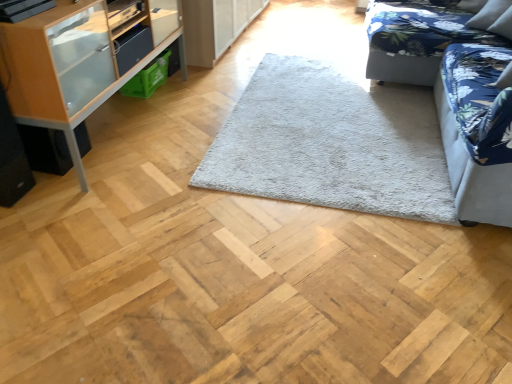
You are a GUI agent. You are given a task and a screenshot of the screen. Output one action in this format:
    pyautogui.click(x=<x>, y=<y>)
    Task: Click on the velvet floral studio couch at right, acting as the second studio couch starting from the back
    The height and width of the screenshot is (384, 512).
    Given the screenshot: What is the action you would take?
    pyautogui.click(x=476, y=131)

This screenshot has height=384, width=512. In order to click on blue floral fabric couch at upper right, the first studio couch in the back-to-front sequence in this screenshot , I will do `click(425, 37)`.

The height and width of the screenshot is (384, 512). I want to click on wooden cabinet at left, so click(x=70, y=65).

Does point (477, 45) appear closer or farther from the camera than point (115, 55)?

Clearly, point (477, 45) is more distant from the camera than point (115, 55).

How distant is velvet floral studio couch at right, acting as the second studio couch starting from the back, from matte black drawer at upper left?

velvet floral studio couch at right, acting as the second studio couch starting from the back, and matte black drawer at upper left are 6.01 feet apart.

Looking at this image, is velvet floral studio couch at right, the first studio couch viewed from the front, further to camera compared to matte black drawer at upper left?

No.

From the picture: How different are the orientations of velvet floral studio couch at right, acting as the second studio couch starting from the back, and matte black drawer at upper left in degrees?

180 degrees.

From the image's perspective, is blue floral fabric couch at upper right, the first studio couch in the back-to-front sequence, on velvet floral studio couch at right, the first studio couch viewed from the front?

Yes, from the image's perspective, blue floral fabric couch at upper right, the first studio couch in the back-to-front sequence, is above velvet floral studio couch at right, the first studio couch viewed from the front.

Which object is positioned more to the left, blue floral fabric couch at upper right, the 2th studio couch positioned from the front, or velvet floral studio couch at right, acting as the second studio couch starting from the back?

velvet floral studio couch at right, acting as the second studio couch starting from the back, is more to the left.

Considering the sizes of objects blue floral fabric couch at upper right, the first studio couch in the back-to-front sequence, and velvet floral studio couch at right, acting as the second studio couch starting from the back, in the image provided, who is bigger, blue floral fabric couch at upper right, the first studio couch in the back-to-front sequence, or velvet floral studio couch at right, acting as the second studio couch starting from the back,?

blue floral fabric couch at upper right, the first studio couch in the back-to-front sequence, is bigger.

Does velvet floral studio couch at right, acting as the second studio couch starting from the back, contain wooden cabinet at left?

No, wooden cabinet at left is not inside velvet floral studio couch at right, acting as the second studio couch starting from the back.

Is velvet floral studio couch at right, the first studio couch viewed from the front, aimed at wooden cabinet at left?

Yes, velvet floral studio couch at right, the first studio couch viewed from the front, faces towards wooden cabinet at left.

From a real-world perspective, is velvet floral studio couch at right, acting as the second studio couch starting from the back, located higher than wooden cabinet at left?

Yes, from a real-world perspective, velvet floral studio couch at right, acting as the second studio couch starting from the back, is above wooden cabinet at left.

Between velvet floral studio couch at right, the first studio couch viewed from the front, and wooden cabinet at left, which one has larger width?

velvet floral studio couch at right, the first studio couch viewed from the front, is wider.

In terms of height, does matte black drawer at upper left look taller or shorter compared to velvet floral studio couch at right, acting as the second studio couch starting from the back?

Considering their sizes, matte black drawer at upper left has less height than velvet floral studio couch at right, acting as the second studio couch starting from the back.

From the image's perspective, who appears lower, matte black drawer at upper left or velvet floral studio couch at right, the first studio couch viewed from the front?

velvet floral studio couch at right, the first studio couch viewed from the front, from the image's perspective.

In the image, is matte black drawer at upper left positioned in front of or behind velvet floral studio couch at right, the first studio couch viewed from the front?

matte black drawer at upper left is positioned farther from the viewer than velvet floral studio couch at right, the first studio couch viewed from the front.

The image size is (512, 384). I want to click on the 1st studio couch located beneath the matte black drawer at upper left (from a real-world perspective), so click(476, 131).

Considering the relative sizes of gray fluffy rug at center and blue floral fabric couch at upper right, the first studio couch in the back-to-front sequence, in the image provided, is gray fluffy rug at center bigger than blue floral fabric couch at upper right, the first studio couch in the back-to-front sequence,?

Actually, gray fluffy rug at center might be smaller than blue floral fabric couch at upper right, the first studio couch in the back-to-front sequence.

Would you say gray fluffy rug at center is to the left or to the right of blue floral fabric couch at upper right, the first studio couch in the back-to-front sequence, in the picture?

From the image, it's evident that gray fluffy rug at center is to the left of blue floral fabric couch at upper right, the first studio couch in the back-to-front sequence.

How many degrees apart are the facing directions of gray fluffy rug at center and blue floral fabric couch at upper right, the first studio couch in the back-to-front sequence?

They differ by 87.3 degrees in their facing directions.

The width and height of the screenshot is (512, 384). In the image, there is a blue floral fabric couch at upper right, the first studio couch in the back-to-front sequence. In order to click on mat below it (from the image's perspective) in this screenshot , I will do `click(331, 143)`.

From the image's perspective, is wooden cabinet at left positioned above or below gray fluffy rug at center?

From the image's perspective, wooden cabinet at left appears above gray fluffy rug at center.

Is wooden cabinet at left aimed at gray fluffy rug at center?

Yes, wooden cabinet at left faces towards gray fluffy rug at center.

Is wooden cabinet at left smaller than gray fluffy rug at center?

No, wooden cabinet at left is not smaller than gray fluffy rug at center.

Is wooden cabinet at left further to the viewer compared to gray fluffy rug at center?

That is False.

Measure the distance between wooden cabinet at left and velvet floral studio couch at right, the first studio couch viewed from the front.

wooden cabinet at left is 6.04 feet away from velvet floral studio couch at right, the first studio couch viewed from the front.

From the image's perspective, would you say wooden cabinet at left is shown under velvet floral studio couch at right, the first studio couch viewed from the front?

No.

Is wooden cabinet at left positioned with its back to velvet floral studio couch at right, acting as the second studio couch starting from the back?

wooden cabinet at left is not turned away from velvet floral studio couch at right, acting as the second studio couch starting from the back.

From a real-world perspective, is wooden cabinet at left above or below velvet floral studio couch at right, the first studio couch viewed from the front?

In terms of real-world spatial position, wooden cabinet at left is below velvet floral studio couch at right, the first studio couch viewed from the front.

Locate an element on the screen. the 1st studio couch located beneath the matte black drawer at upper left (from a real-world perspective) is located at coordinates (476, 131).

This screenshot has height=384, width=512. Identify the location of studio couch behind the velvet floral studio couch at right, the first studio couch viewed from the front. (425, 37).

From the image, which object appears to be nearer to matte black drawer at upper left, gray fluffy rug at center or blue floral fabric couch at upper right, the 2th studio couch positioned from the front?

gray fluffy rug at center.

Considering their positions, is gray fluffy rug at center positioned closer to blue floral fabric couch at upper right, the 2th studio couch positioned from the front, than velvet floral studio couch at right, the first studio couch viewed from the front?

The object closer to blue floral fabric couch at upper right, the 2th studio couch positioned from the front, is velvet floral studio couch at right, the first studio couch viewed from the front.

When comparing their distances from blue floral fabric couch at upper right, the first studio couch in the back-to-front sequence, does wooden cabinet at left or velvet floral studio couch at right, the first studio couch viewed from the front, seem closer?

Among the two, velvet floral studio couch at right, the first studio couch viewed from the front, is located nearer to blue floral fabric couch at upper right, the first studio couch in the back-to-front sequence.

Which object lies further to the anchor point wooden cabinet at left, gray fluffy rug at center or blue floral fabric couch at upper right, the 2th studio couch positioned from the front?

Based on the image, blue floral fabric couch at upper right, the 2th studio couch positioned from the front, appears to be further to wooden cabinet at left.

Considering their positions, is wooden cabinet at left positioned further to gray fluffy rug at center than blue floral fabric couch at upper right, the 2th studio couch positioned from the front?

wooden cabinet at left is further to gray fluffy rug at center.

Based on their spatial positions, is blue floral fabric couch at upper right, the 2th studio couch positioned from the front, or matte black drawer at upper left closer to velvet floral studio couch at right, the first studio couch viewed from the front?

Based on the image, blue floral fabric couch at upper right, the 2th studio couch positioned from the front, appears to be nearer to velvet floral studio couch at right, the first studio couch viewed from the front.

Considering their positions, is gray fluffy rug at center positioned further to velvet floral studio couch at right, the first studio couch viewed from the front, than blue floral fabric couch at upper right, the first studio couch in the back-to-front sequence?

The object further to velvet floral studio couch at right, the first studio couch viewed from the front, is blue floral fabric couch at upper right, the first studio couch in the back-to-front sequence.

Based on their spatial positions, is wooden cabinet at left or blue floral fabric couch at upper right, the first studio couch in the back-to-front sequence, closer to velvet floral studio couch at right, the first studio couch viewed from the front?

blue floral fabric couch at upper right, the first studio couch in the back-to-front sequence, is closer to velvet floral studio couch at right, the first studio couch viewed from the front.

Where is `mat between wooden cabinet at left and blue floral fabric couch at upper right, the first studio couch in the back-to-front sequence, from left to right`? The image size is (512, 384). mat between wooden cabinet at left and blue floral fabric couch at upper right, the first studio couch in the back-to-front sequence, from left to right is located at coordinates (331, 143).

Locate an element on the screen. Image resolution: width=512 pixels, height=384 pixels. drawer situated between wooden cabinet at left and gray fluffy rug at center from left to right is located at coordinates (132, 47).

Find the location of `mat between wooden cabinet at left and velvet floral studio couch at right, the first studio couch viewed from the front, in the horizontal direction`. mat between wooden cabinet at left and velvet floral studio couch at right, the first studio couch viewed from the front, in the horizontal direction is located at coordinates (331, 143).

Locate an element on the screen. studio couch located between matte black drawer at upper left and blue floral fabric couch at upper right, the 2th studio couch positioned from the front, in the left-right direction is located at coordinates (476, 131).